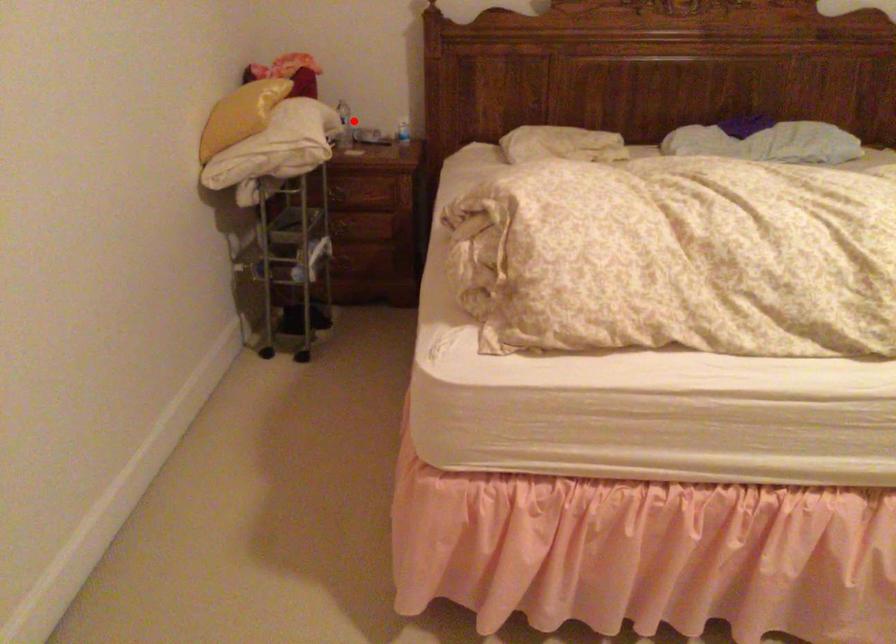
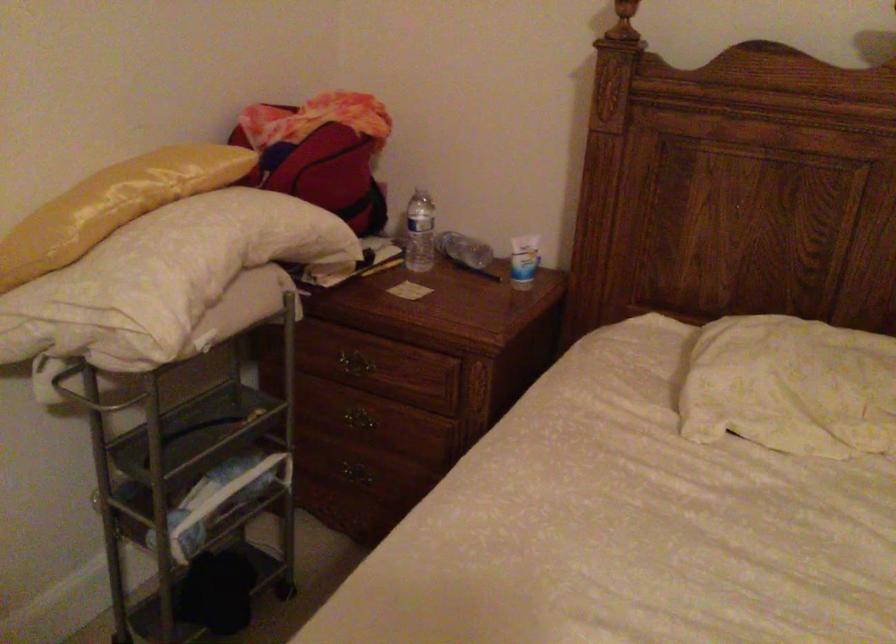
The point at the highlighted location is marked in the first image. Where is the corresponding point in the second image?

(419, 232)